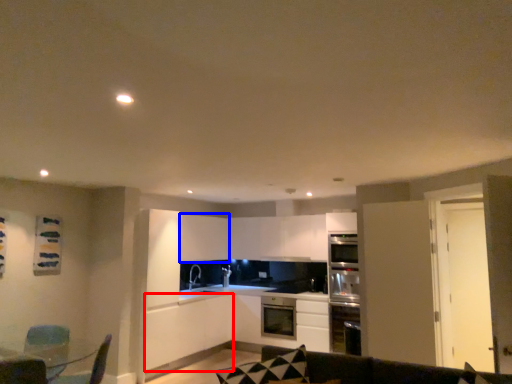
Question: Among these objects, which one is farthest to the camera, cabinetry (highlighted by a red box) or cabinetry (highlighted by a blue box)?

Choices:
 (A) cabinetry
 (B) cabinetry

Answer: (B)